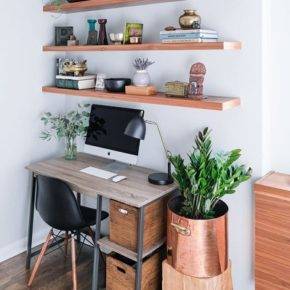
Identify the location of plant. This screenshot has width=290, height=290. (208, 166).